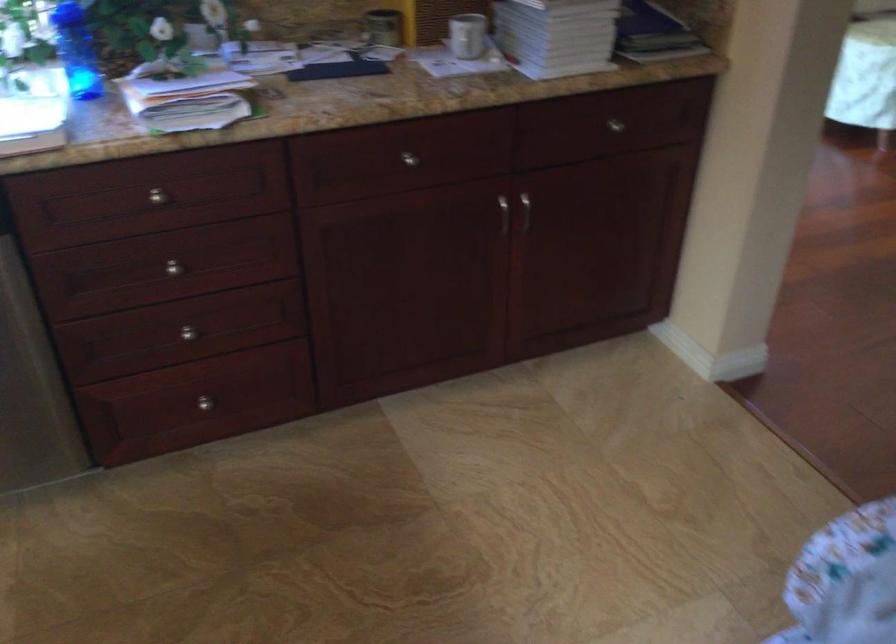
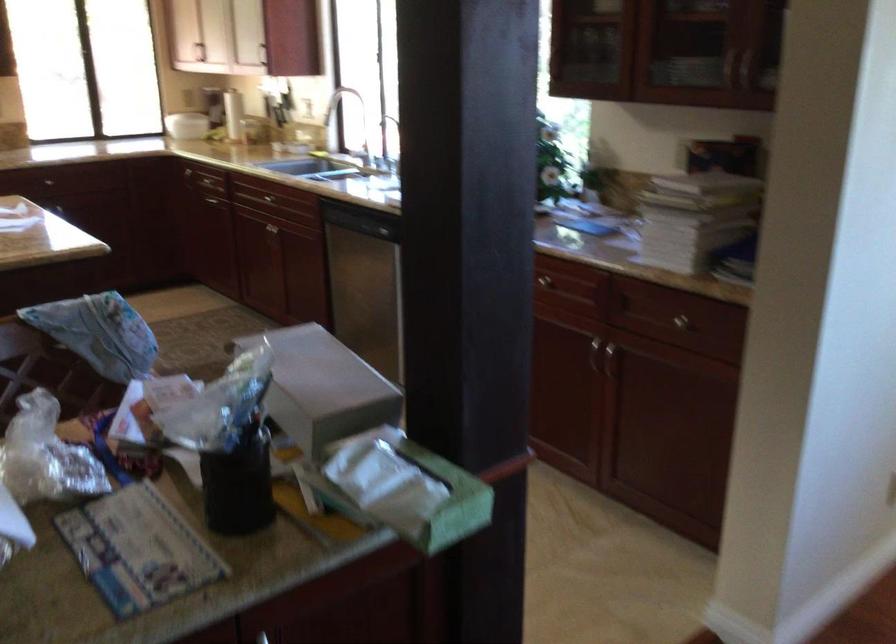
Locate, in the second image, the point that corresponds to pixel 526 211 in the first image.

(610, 361)